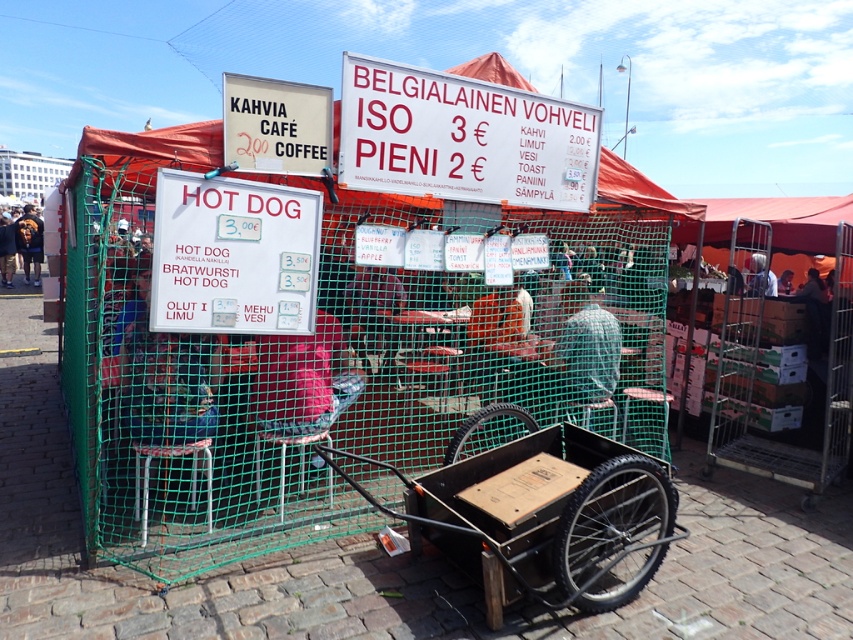
You are a customer at the market stall and want to compare the prices of the items listed on the white plastic sign at upper center and the white paper sign at center. Which sign has a larger physical size?

The white plastic sign at upper center has a larger physical size than the white paper sign at center because its width surpasses the latter.

Based on the photo, you are a customer at the market stall and want to read both the white plastic sign at upper center and the white paper sign at center. Which sign do you need to look up higher to read?

The white plastic sign at upper center is much taller than the white paper sign at center, so you need to look up higher to read the white plastic sign at upper center.

You are a customer at the market stall and want to order a hot dog. You see the wooden cart at lower center and the white paper sign at center. Which object is closer to the ground?

The wooden cart at lower center is located below the white paper sign at center, so the wooden cart at lower center is closer to the ground.